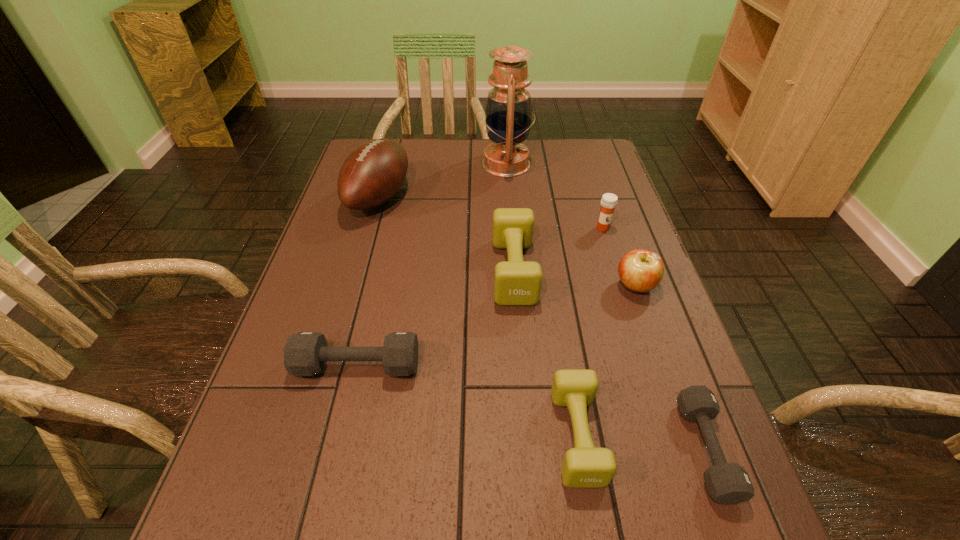
You are a GUI agent. You are given a task and a screenshot of the screen. Output one action in this format:
    pyautogui.click(x=<x>, y=<y>)
    Task: Click on the free space located on the left of the smaller olive dumbbell
    
    Given the screenshot: What is the action you would take?
    pos(351,436)

Where is `vacant area located on the back of the rightmost dumbbell`? The height and width of the screenshot is (540, 960). vacant area located on the back of the rightmost dumbbell is located at coordinates (653, 306).

Identify the location of oil lamp that is at the far edge. (508, 113).

At what (x,y) coordinates should I click in order to perform the action: click on football (American) that is at the far edge. Please return your answer as a coordinate pair (x, y). Looking at the image, I should click on (373, 173).

You are a GUI agent. You are given a task and a screenshot of the screen. Output one action in this format:
    pyautogui.click(x=<x>, y=<y>)
    Task: Click on the football (American) situated at the left edge
    Image resolution: width=960 pixels, height=540 pixels.
    Given the screenshot: What is the action you would take?
    pyautogui.click(x=373, y=173)

Locate an element on the screen. The image size is (960, 540). dumbbell positioned at the left edge is located at coordinates (305, 353).

Identify the location of medicine situated at the right edge. (608, 202).

The height and width of the screenshot is (540, 960). I want to click on apple that is at the right edge, so click(x=640, y=270).

The image size is (960, 540). I want to click on dumbbell that is at the right edge, so click(x=728, y=483).

Identify the location of object that is at the far left corner. (373, 173).